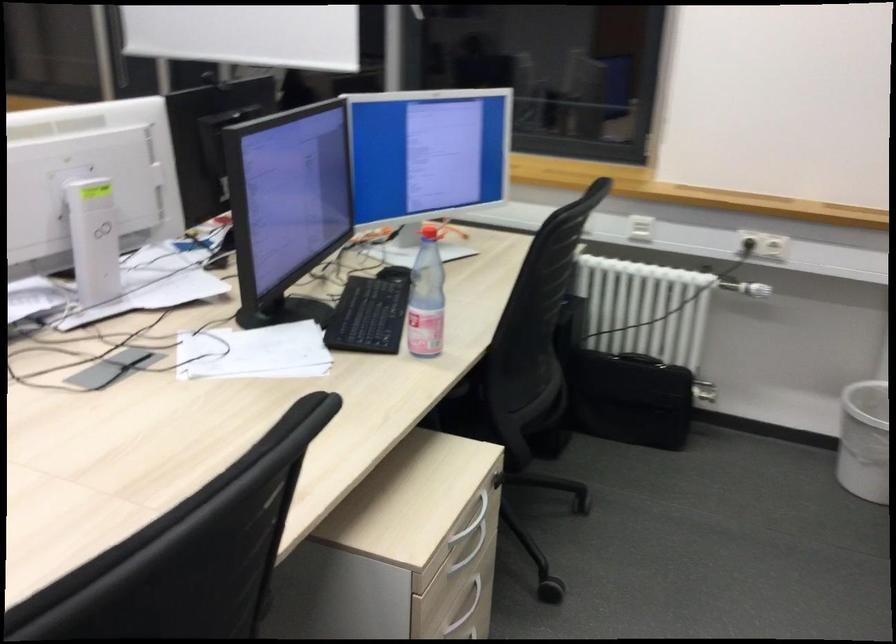
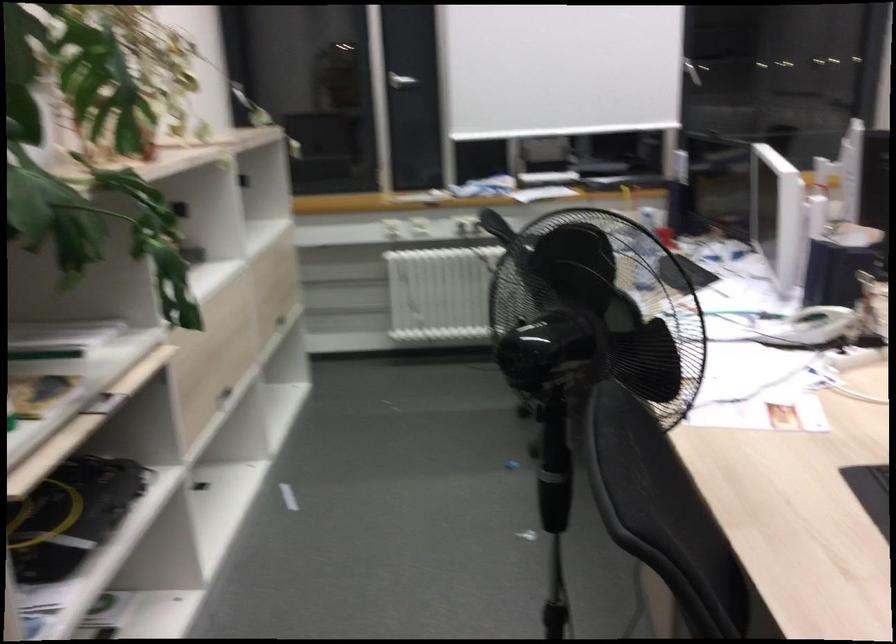
Question: In a continuous first-person perspective shot, in which direction is the camera moving?

Choices:
 (A) Left
 (B) Right
 (C) Forward
 (D) Backward

Answer: (A)